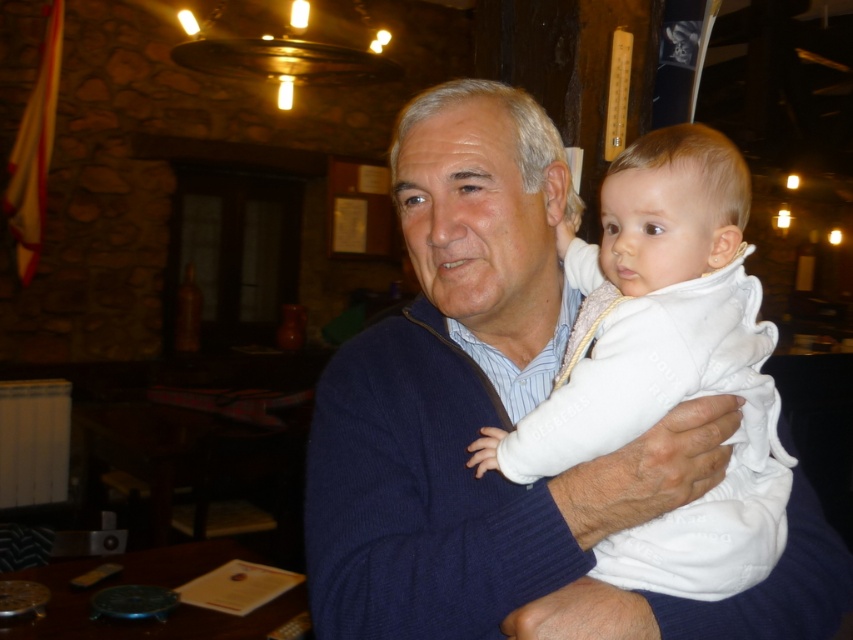
Question: Which object appears farthest from the camera in this image?

Choices:
 (A) white soft fabric at center
 (B) white soft baby at center

Answer: (B)

Question: Can you confirm if white soft baby at center is thinner than white soft fabric at center?

Choices:
 (A) yes
 (B) no

Answer: (A)

Question: Does white soft baby at center appear over white soft fabric at center?

Choices:
 (A) yes
 (B) no

Answer: (A)

Question: Is white soft baby at center above white soft fabric at center?

Choices:
 (A) yes
 (B) no

Answer: (A)